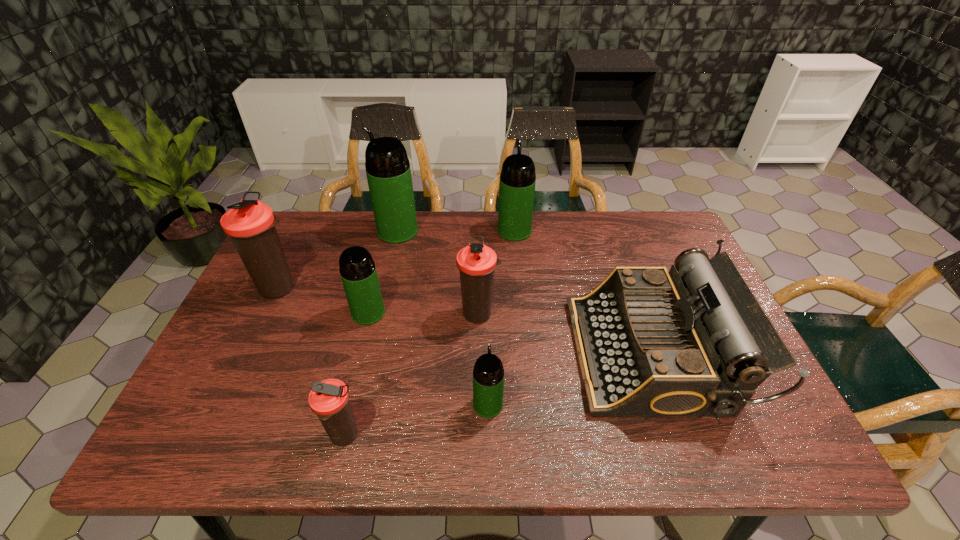
Where is `free point between the second biggest green thermos bottle and the second brown thermos bottle from right to left`? Image resolution: width=960 pixels, height=540 pixels. free point between the second biggest green thermos bottle and the second brown thermos bottle from right to left is located at coordinates (429, 334).

Identify the location of free point between the typewriter and the second nearest green thermos bottle. This screenshot has width=960, height=540. (510, 333).

Where is `free space between the smallest brown thermos bottle and the third green thermos bottle from left to right`? The width and height of the screenshot is (960, 540). free space between the smallest brown thermos bottle and the third green thermos bottle from left to right is located at coordinates (417, 420).

Find the location of a particular element. This screenshot has width=960, height=540. unoccupied area between the biggest green thermos bottle and the third biggest green thermos bottle is located at coordinates (383, 272).

At what (x,y) coordinates should I click in order to perform the action: click on free spot between the biggest green thermos bottle and the second brown thermos bottle from right to left. Please return your answer as a coordinate pair (x, y). This screenshot has height=540, width=960. Looking at the image, I should click on (372, 334).

At what (x,y) coordinates should I click in order to perform the action: click on free space that is in between the tallest object and the second smallest green thermos bottle. Please return your answer as a coordinate pair (x, y). Looking at the image, I should click on (383, 272).

Locate an element on the screen. This screenshot has width=960, height=540. the third closest object relative to the second smallest brown thermos bottle is located at coordinates (358, 272).

Point out which object is positioned as the sixth nearest to the biggest green thermos bottle. Please provide its 2D coordinates. Your answer should be formatted as a tuple, i.e. [(x, y)], where the tuple contains the x and y coordinates of a point satisfying the conditions above.

[(488, 374)]

Where is `the sixth closest thermos bottle relative to the typewriter`? The image size is (960, 540). the sixth closest thermos bottle relative to the typewriter is located at coordinates (388, 171).

Locate which thermos bottle is the third closest to the smallest green thermos bottle. Please provide its 2D coordinates. Your answer should be formatted as a tuple, i.e. [(x, y)], where the tuple contains the x and y coordinates of a point satisfying the conditions above.

[(358, 272)]